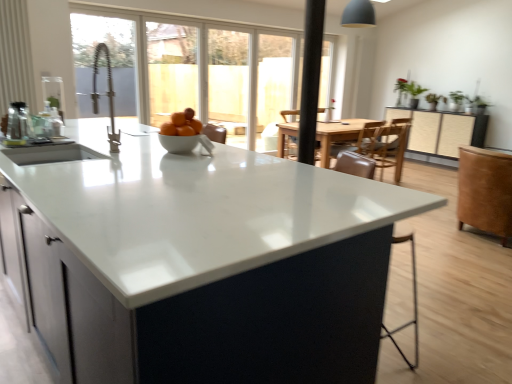
Question: Is the surface of white glossy bowl at center in direct contact with white glossy countertop at center?

Choices:
 (A) yes
 (B) no

Answer: (B)

Question: Is white glossy bowl at center to the right of white glossy countertop at center from the viewer's perspective?

Choices:
 (A) no
 (B) yes

Answer: (B)

Question: Is white glossy bowl at center positioned in front of white glossy countertop at center?

Choices:
 (A) yes
 (B) no

Answer: (B)

Question: Is white glossy bowl at center aimed at white glossy countertop at center?

Choices:
 (A) no
 (B) yes

Answer: (A)

Question: From a real-world perspective, is white glossy bowl at center positioned over white glossy countertop at center based on gravity?

Choices:
 (A) no
 (B) yes

Answer: (B)

Question: Looking at the image, does white glossy bowl at center seem bigger or smaller compared to brown leather swivel chair at right?

Choices:
 (A) small
 (B) big

Answer: (A)

Question: Relative to brown leather swivel chair at right, is white glossy bowl at center in front or behind?

Choices:
 (A) behind
 (B) front

Answer: (B)

Question: Is white glossy bowl at center taller or shorter than brown leather swivel chair at right?

Choices:
 (A) tall
 (B) short

Answer: (B)

Question: From the image's perspective, is white glossy bowl at center positioned above or below brown leather swivel chair at right?

Choices:
 (A) below
 (B) above

Answer: (B)

Question: Looking at their shapes, would you say brown leather armchair at center is wider or thinner than matte white bowl at center?

Choices:
 (A) wide
 (B) thin

Answer: (A)

Question: Is brown leather armchair at center bigger or smaller than matte white bowl at center?

Choices:
 (A) small
 (B) big

Answer: (B)

Question: Is brown leather armchair at center situated inside matte white bowl at center or outside?

Choices:
 (A) inside
 (B) outside

Answer: (B)

Question: Based on their positions, is brown leather armchair at center located to the left or right of matte white bowl at center?

Choices:
 (A) right
 (B) left

Answer: (A)

Question: From the image's perspective, is black matte faucet at upper left, the 1th window screen viewed from the front, above or below white glossy countertop at center?

Choices:
 (A) above
 (B) below

Answer: (A)

Question: Based on their positions, is black matte faucet at upper left, the 1th window screen viewed from the front, located to the left or right of white glossy countertop at center?

Choices:
 (A) right
 (B) left

Answer: (A)